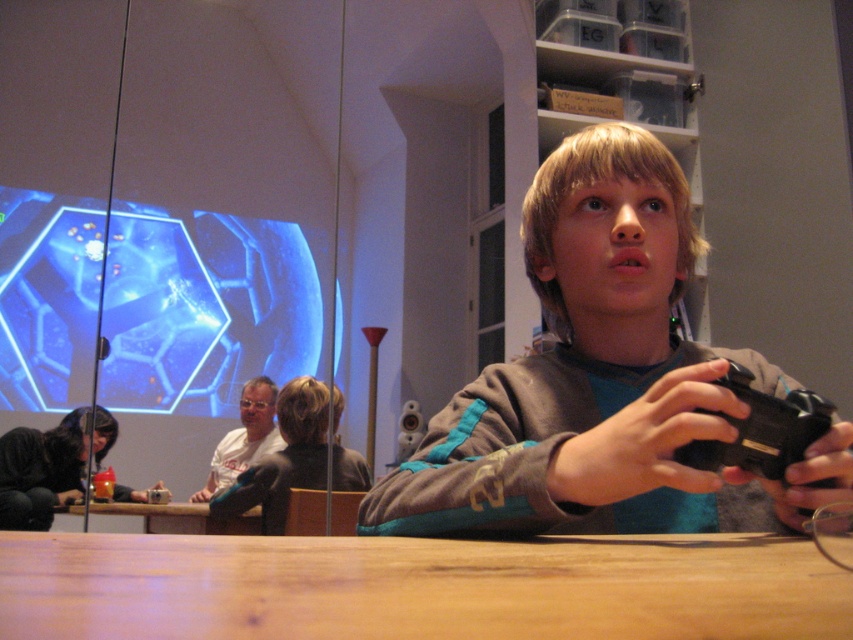
Consider the image. Between matte gray hoodie at center and brown wooden table at lower center, which one appears on the left side from the viewer's perspective?

brown wooden table at lower center

Who is shorter, matte gray hoodie at center or brown wooden table at lower center?

brown wooden table at lower center is shorter.

This screenshot has width=853, height=640. In order to click on matte gray hoodie at center in this screenshot , I will do `click(601, 380)`.

Who is more distant from viewer, [801,604] or [78,513]?

Point [78,513]

Between point (721, 604) and point (175, 504), which one is positioned in front?

Point (721, 604) is more forward.

The width and height of the screenshot is (853, 640). Identify the location of wooden table at lower center. (418, 586).

Does matte gray hoodie at center have a greater width compared to black matte camera at lower right?

Yes.

What are the coordinates of `matte gray hoodie at center` in the screenshot? It's located at (601, 380).

Is point (645, 145) farther from camera compared to point (714, 449)?

That is True.

The image size is (853, 640). I want to click on matte gray hoodie at center, so click(x=601, y=380).